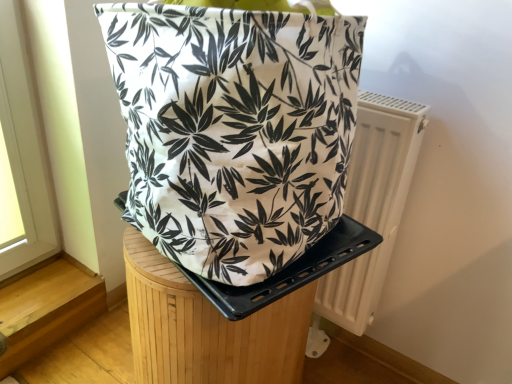
Question: Does wooden stool at center turn towards white plastic radiator at right?

Choices:
 (A) yes
 (B) no

Answer: (B)

Question: Does wooden stool at center have a smaller size compared to white plastic radiator at right?

Choices:
 (A) yes
 (B) no

Answer: (B)

Question: Is wooden stool at center with white plastic radiator at right?

Choices:
 (A) no
 (B) yes

Answer: (A)

Question: Is wooden stool at center positioned behind white plastic radiator at right?

Choices:
 (A) yes
 (B) no

Answer: (B)

Question: Is wooden stool at center wider than white plastic radiator at right?

Choices:
 (A) yes
 (B) no

Answer: (A)

Question: Choose the correct answer: Is white canvas bag at center inside white plastic radiator at right or outside it?

Choices:
 (A) outside
 (B) inside

Answer: (A)

Question: From a real-world perspective, is white canvas bag at center physically located above or below white plastic radiator at right?

Choices:
 (A) above
 (B) below

Answer: (A)

Question: In terms of width, does white canvas bag at center look wider or thinner when compared to white plastic radiator at right?

Choices:
 (A) thin
 (B) wide

Answer: (B)

Question: In the image, is white canvas bag at center positioned in front of or behind white plastic radiator at right?

Choices:
 (A) behind
 (B) front

Answer: (B)

Question: Considering the positions of white plastic radiator at right and white canvas bag at center in the image, is white plastic radiator at right wider or thinner than white canvas bag at center?

Choices:
 (A) thin
 (B) wide

Answer: (A)

Question: Is white plastic radiator at right to the left or to the right of white canvas bag at center in the image?

Choices:
 (A) left
 (B) right

Answer: (B)

Question: Based on their sizes in the image, would you say white plastic radiator at right is bigger or smaller than white canvas bag at center?

Choices:
 (A) small
 (B) big

Answer: (A)

Question: Considering the positions of white plastic radiator at right and white canvas bag at center in the image, is white plastic radiator at right taller or shorter than white canvas bag at center?

Choices:
 (A) tall
 (B) short

Answer: (A)

Question: Is white plastic radiator at right to the left or to the right of wooden stool at center in the image?

Choices:
 (A) left
 (B) right

Answer: (B)

Question: In terms of height, does white plastic radiator at right look taller or shorter compared to wooden stool at center?

Choices:
 (A) short
 (B) tall

Answer: (B)